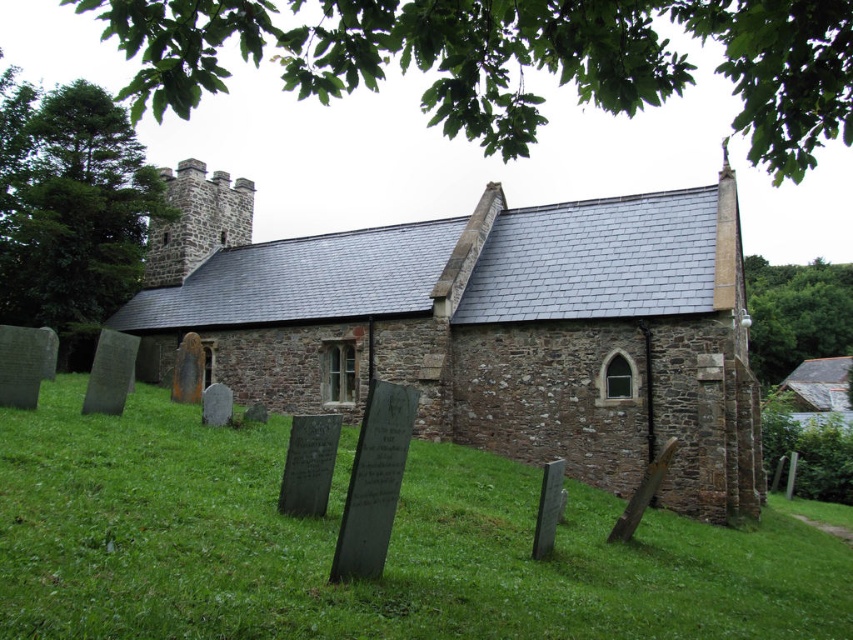
Find the location of a particular element. green stone gravestones at lower left is located at coordinates (387, 547).

Between point (787, 595) and point (688, 456), which one is positioned in front?

Positioned in front is point (787, 595).

Locate an element on the screen. The image size is (853, 640). green stone gravestones at lower left is located at coordinates (387, 547).